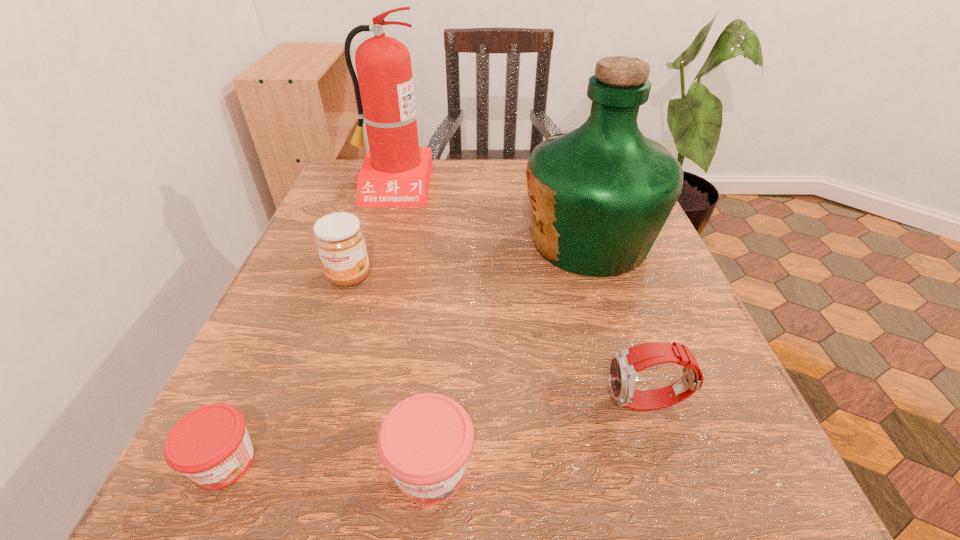
The width and height of the screenshot is (960, 540). What are the coordinates of `object situated at the far left corner` in the screenshot? It's located at (396, 172).

At what (x,y) coordinates should I click in order to perform the action: click on object that is at the near left corner. Please return your answer as a coordinate pair (x, y). This screenshot has height=540, width=960. Looking at the image, I should click on (211, 446).

I want to click on object that is at the far right corner, so click(599, 195).

The image size is (960, 540). Find the location of `blank space at the far edge`. blank space at the far edge is located at coordinates (436, 204).

Identify the location of vacant space at the near edge of the desktop. (391, 499).

Locate an element on the screen. free region at the left edge of the desktop is located at coordinates (356, 319).

The width and height of the screenshot is (960, 540). What are the coordinates of `vacant space at the right edge` in the screenshot? It's located at (626, 292).

Locate an element on the screen. The height and width of the screenshot is (540, 960). free space at the far left corner is located at coordinates (352, 162).

I want to click on empty space that is in between the tallest jam and the shortest object, so click(x=287, y=369).

I want to click on vacant region between the third nearest object and the liquor, so click(x=618, y=322).